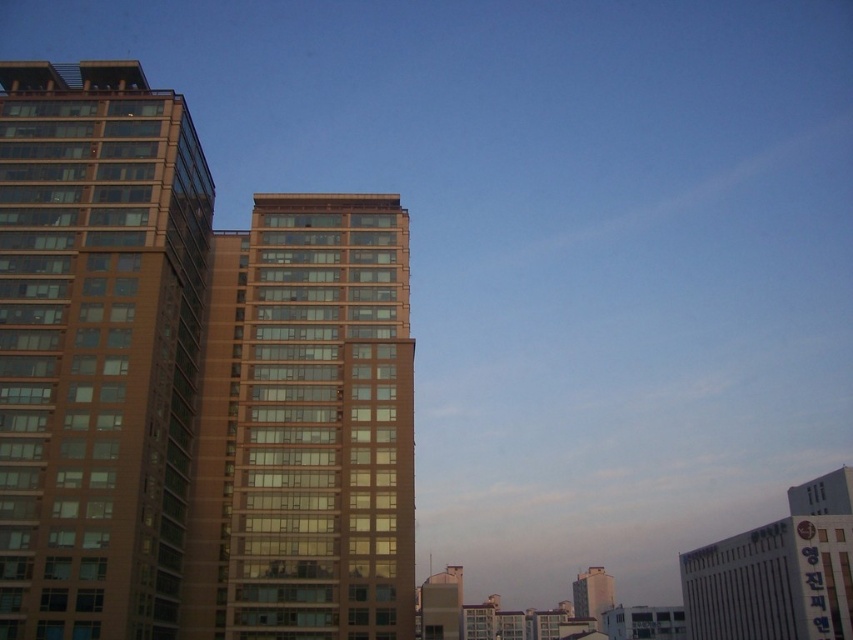
Question: Estimate the real-world distances between objects in this image. Which object is closer to the matte brown building at center?

Choices:
 (A) brown glass building at left
 (B) brown glass building at center

Answer: (B)

Question: Which object appears farthest from the camera in this image?

Choices:
 (A) brown glass building at left
 (B) brown glass building at center

Answer: (B)

Question: Which point is closer to the camera taking this photo?

Choices:
 (A) (590, 605)
 (B) (41, 252)

Answer: (B)

Question: Is brown glass building at left in front of brown glass building at center?

Choices:
 (A) no
 (B) yes

Answer: (B)

Question: Is brown glass building at center below matte brown building at center?

Choices:
 (A) no
 (B) yes

Answer: (A)

Question: Does brown glass building at center have a greater width compared to matte brown building at center?

Choices:
 (A) no
 (B) yes

Answer: (A)